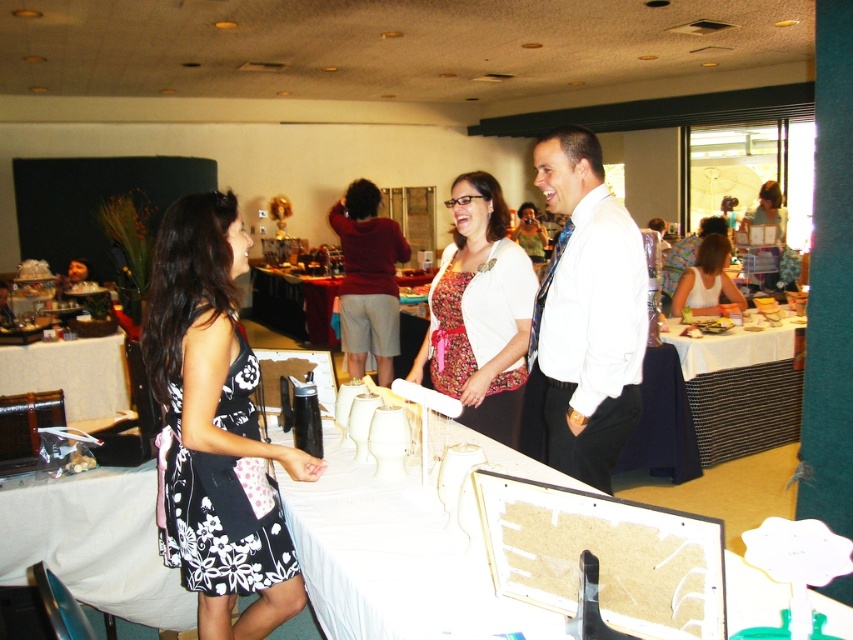
Question: Does floral-patterned fabric dress at left appear over white matte blouse at center?

Choices:
 (A) yes
 (B) no

Answer: (B)

Question: Is floral fabric dress at center further to camera compared to white matte dress at center?

Choices:
 (A) yes
 (B) no

Answer: (B)

Question: Which is farther from the white glossy table at left?

Choices:
 (A) white matte blouse at center
 (B) white fabric table at center

Answer: (A)

Question: Observing the image, what is the correct spatial positioning of white matte board at center in reference to white glossy table at left?

Choices:
 (A) below
 (B) above

Answer: (A)

Question: Estimate the real-world distances between objects in this image. Which object is farther from the white glossy table at left?

Choices:
 (A) white matte dress at center
 (B) matte red sweater at center
 (C) white shirt at center
 (D) floral fabric dress at center

Answer: (A)

Question: Which object is closer to the camera taking this photo?

Choices:
 (A) wooden table at center
 (B) white fabric table at center
 (C) white matte blouse at center

Answer: (B)